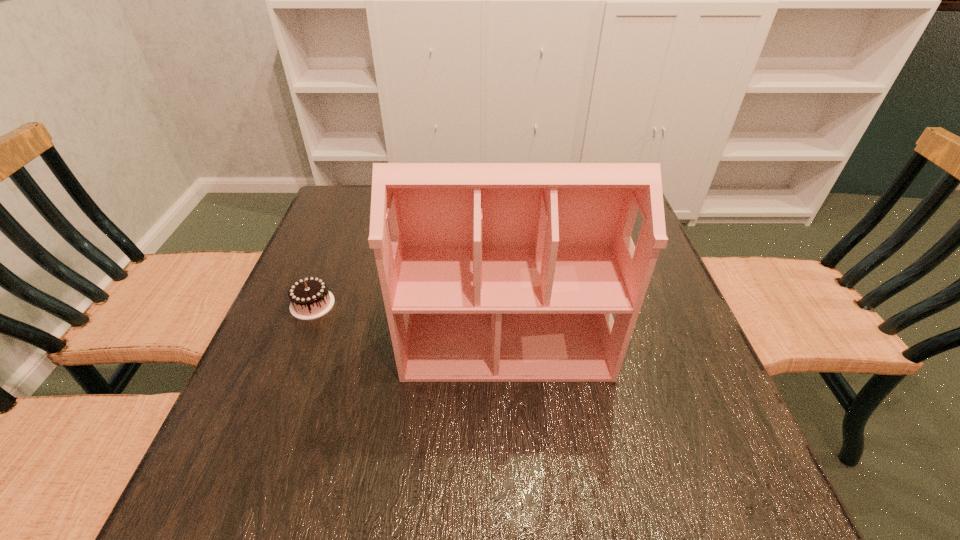
Image resolution: width=960 pixels, height=540 pixels. I want to click on the right object, so click(495, 272).

This screenshot has width=960, height=540. What are the coordinates of `dollhouse` in the screenshot? It's located at (495, 272).

Locate an element on the screen. Image resolution: width=960 pixels, height=540 pixels. the shorter object is located at coordinates (310, 299).

You are a GUI agent. You are given a task and a screenshot of the screen. Output one action in this format:
    pyautogui.click(x=<x>, y=<y>)
    Task: Click on the chocolate cake
    The image size is (960, 540).
    Given the screenshot: What is the action you would take?
    (x=310, y=299)

Where is `free space located on the front-facing side of the taller object`? free space located on the front-facing side of the taller object is located at coordinates (515, 502).

What are the coordinates of `free location located on the back of the chocolate cake` in the screenshot? It's located at (327, 267).

This screenshot has height=540, width=960. Identify the location of object at the left edge. (310, 299).

The image size is (960, 540). I want to click on vacant space at the near edge, so click(463, 487).

Where is `vacant space at the left edge`? The image size is (960, 540). vacant space at the left edge is located at coordinates (361, 244).

The image size is (960, 540). In order to click on blank space at the right edge in this screenshot , I will do `click(624, 361)`.